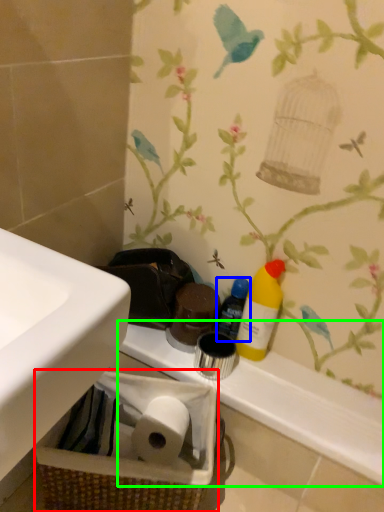
Question: Based on their relative distances, which object is nearer to basket container (highlighted by a red box)? Choose from bottle (highlighted by a blue box) and counter top (highlighted by a green box).

Choices:
 (A) bottle
 (B) counter top

Answer: (B)